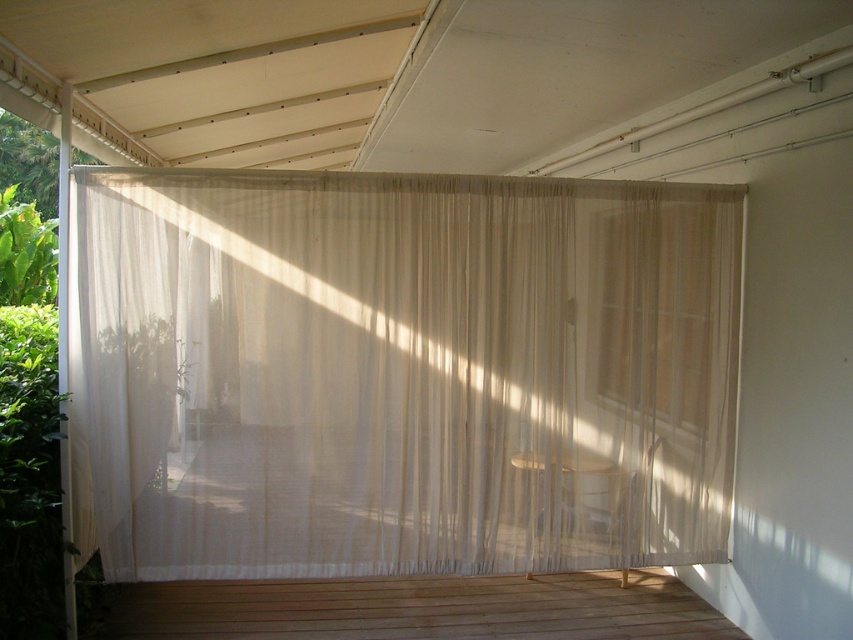
Which of these two, sheer white curtain at center or wooden deck at lower center, stands taller?

sheer white curtain at center is taller.

Is point (409, 308) positioned before point (730, 628)?

Yes, point (409, 308) is in front of point (730, 628).

Locate an element on the screen. The height and width of the screenshot is (640, 853). sheer white curtain at center is located at coordinates (399, 372).

How much distance is there between sheer white curtain at center and translucent fabric window at upper right?

sheer white curtain at center is 18.97 inches from translucent fabric window at upper right.

Which is behind, point (320, 560) or point (659, 378)?

The point (659, 378) is more distant.

At what (x,y) coordinates should I click in order to perform the action: click on sheer white curtain at center. Please return your answer as a coordinate pair (x, y). The height and width of the screenshot is (640, 853). Looking at the image, I should click on (399, 372).

Is point (274, 618) farther from camera compared to point (665, 202)?

Yes.

How much distance is there between wooden deck at lower center and translucent fabric window at upper right?

The distance of wooden deck at lower center from translucent fabric window at upper right is 5.15 feet.

Is point (669, 588) behind point (714, 308)?

Yes, it is behind point (714, 308).

The width and height of the screenshot is (853, 640). I want to click on wooden deck at lower center, so click(418, 609).